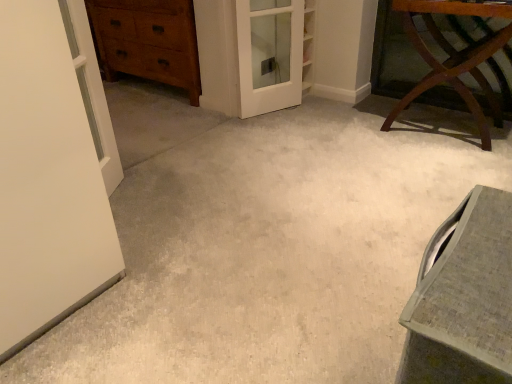
Question: Can you confirm if white glossy door at upper left is positioned to the left of white glass screen door at center?

Choices:
 (A) no
 (B) yes

Answer: (B)

Question: Does white glossy door at upper left have a larger size compared to white glass screen door at center?

Choices:
 (A) no
 (B) yes

Answer: (A)

Question: Is white glossy door at upper left oriented away from white glass screen door at center?

Choices:
 (A) yes
 (B) no

Answer: (B)

Question: Can you confirm if white glossy door at upper left is thinner than white glass screen door at center?

Choices:
 (A) yes
 (B) no

Answer: (A)

Question: Is white glossy door at upper left next to white glass screen door at center and touching it?

Choices:
 (A) no
 (B) yes

Answer: (A)

Question: From a real-world perspective, is mahogany wood table at upper right above or below white glass screen door at center?

Choices:
 (A) below
 (B) above

Answer: (B)

Question: In terms of size, does mahogany wood table at upper right appear bigger or smaller than white glass screen door at center?

Choices:
 (A) small
 (B) big

Answer: (B)

Question: Considering the relative positions of mahogany wood table at upper right and white glass screen door at center in the image provided, is mahogany wood table at upper right to the left or to the right of white glass screen door at center?

Choices:
 (A) right
 (B) left

Answer: (A)

Question: Considering the positions of mahogany wood table at upper right and white glass screen door at center in the image, is mahogany wood table at upper right wider or thinner than white glass screen door at center?

Choices:
 (A) wide
 (B) thin

Answer: (A)

Question: Considering their positions, is matte gray vanity at lower right located in front of or behind wooden chest of drawers at upper left?

Choices:
 (A) behind
 (B) front

Answer: (B)

Question: From the image's perspective, is matte gray vanity at lower right positioned above or below wooden chest of drawers at upper left?

Choices:
 (A) below
 (B) above

Answer: (A)

Question: From a real-world perspective, is matte gray vanity at lower right positioned above or below wooden chest of drawers at upper left?

Choices:
 (A) below
 (B) above

Answer: (A)

Question: Based on their sizes in the image, would you say matte gray vanity at lower right is bigger or smaller than wooden chest of drawers at upper left?

Choices:
 (A) small
 (B) big

Answer: (A)

Question: In terms of width, does white glossy door at upper left look wider or thinner when compared to matte gray vanity at lower right?

Choices:
 (A) wide
 (B) thin

Answer: (B)

Question: Is white glossy door at upper left in front of or behind matte gray vanity at lower right in the image?

Choices:
 (A) front
 (B) behind

Answer: (B)